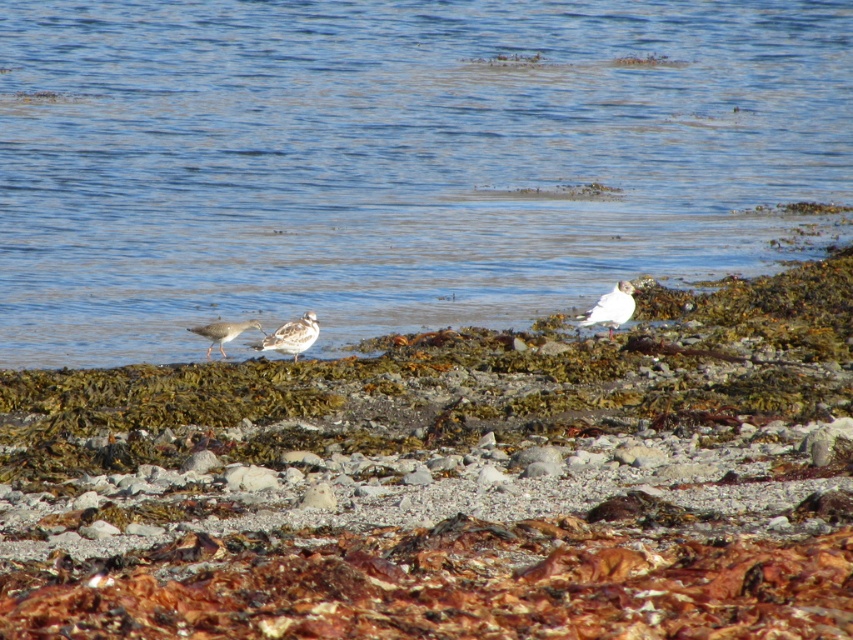
Question: Which point appears closest to the camera in this image?

Choices:
 (A) (601, 321)
 (B) (262, 340)

Answer: (B)

Question: Which object is the farthest from the white feathered bird at center?

Choices:
 (A) speckled gray bird at center
 (B) blue water at center

Answer: (B)

Question: Among these objects, which one is nearest to the camera?

Choices:
 (A) white matte bird at right
 (B) white feathered bird at center
 (C) blue water at center

Answer: (B)

Question: Does blue water at center have a lesser width compared to speckled gray bird at center?

Choices:
 (A) yes
 (B) no

Answer: (B)

Question: Can you confirm if white feathered bird at center is positioned to the right of speckled gray bird at center?

Choices:
 (A) no
 (B) yes

Answer: (B)

Question: Does blue water at center appear over white matte bird at right?

Choices:
 (A) no
 (B) yes

Answer: (B)